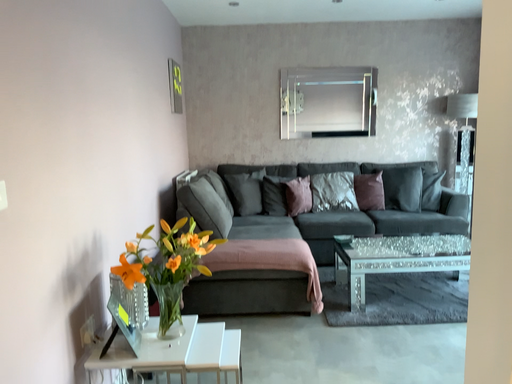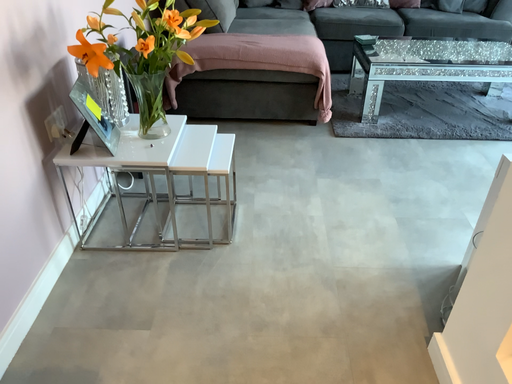
Question: How did the camera likely rotate when shooting the video?

Choices:
 (A) rotated upward
 (B) rotated downward

Answer: (B)